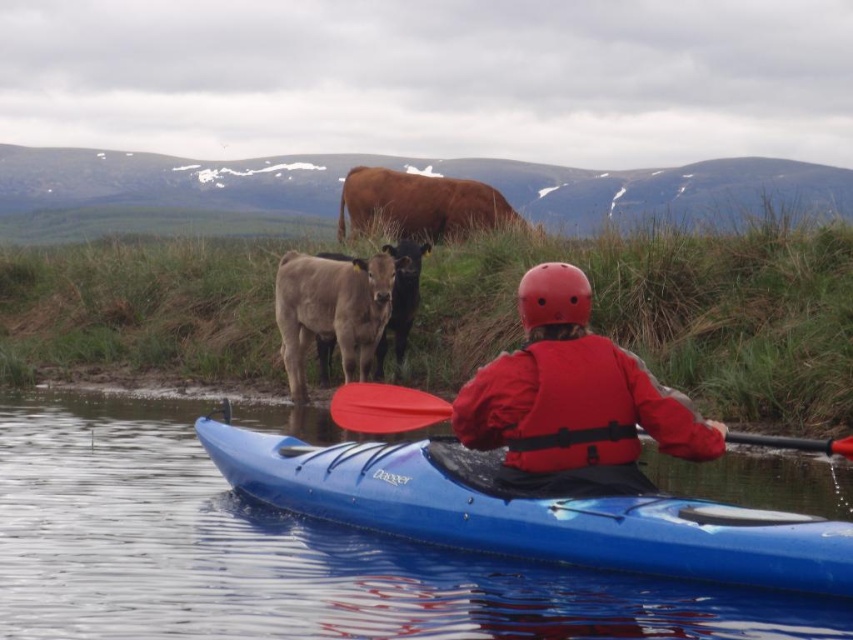
Question: Estimate the real-world distances between objects in this image. Which object is closer to the smooth brown calf at center?

Choices:
 (A) red matte life vest at center
 (B) blue plastic canoe at center
 (C) red plastic paddle at center

Answer: (B)

Question: Which point appears closest to the camera in this image?

Choices:
 (A) (526, 428)
 (B) (561, 292)
 (C) (595, 472)

Answer: (B)

Question: Does blue plastic canoe at center come behind smooth brown calf at center?

Choices:
 (A) yes
 (B) no

Answer: (B)

Question: Is the position of smooth brown calf at center less distant than that of red matte helmet at center?

Choices:
 (A) no
 (B) yes

Answer: (A)

Question: Is red matte life jacket at center behind smooth brown calf at center?

Choices:
 (A) yes
 (B) no

Answer: (B)

Question: Which point is farther from the camera taking this photo?

Choices:
 (A) (346, 284)
 (B) (538, 269)
 (C) (630, 448)

Answer: (A)